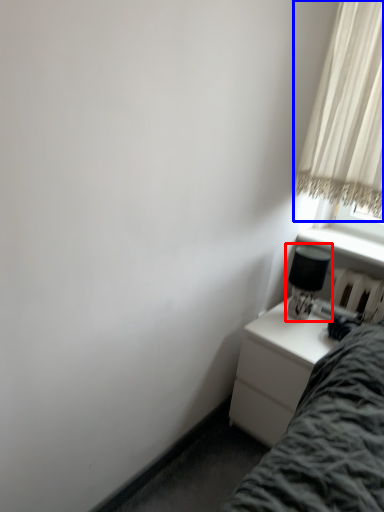
Question: Which object appears farthest to the camera in this image, table lamp (highlighted by a red box) or curtain (highlighted by a blue box)?

Choices:
 (A) table lamp
 (B) curtain

Answer: (A)